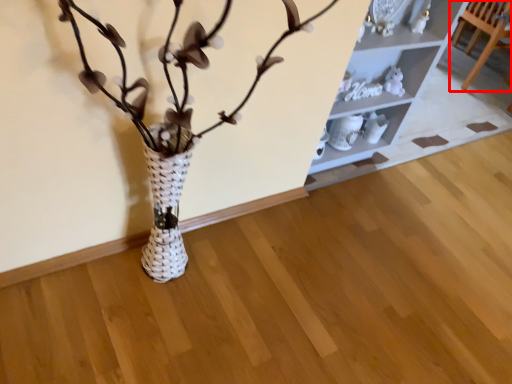
Question: From the image's perspective, where is furniture (annotated by the red box) located relative to shelf?

Choices:
 (A) below
 (B) above

Answer: (B)